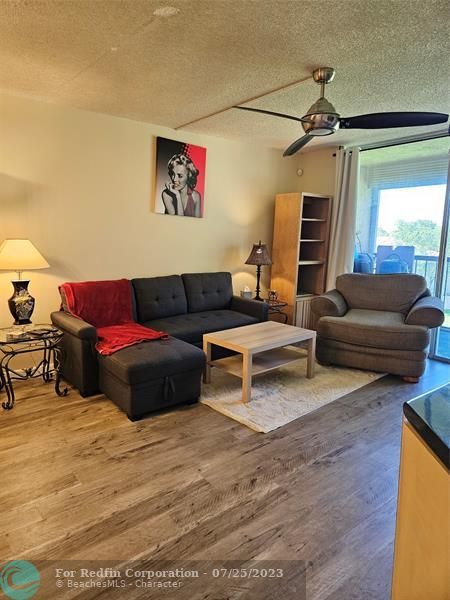
Locate an element on the screen. The image size is (450, 600). fan is located at coordinates (311, 129).